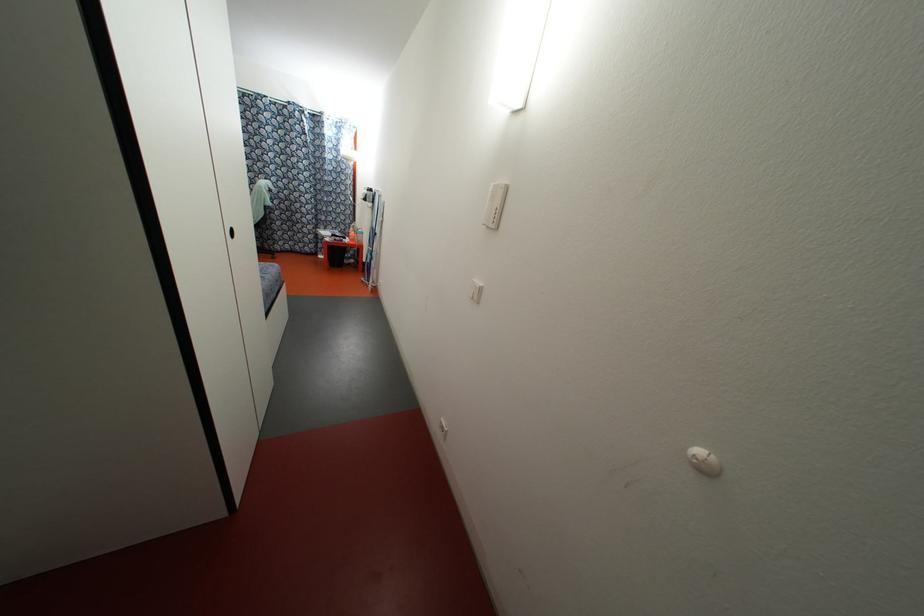
Where is `recessed door handle`? The image size is (924, 616). recessed door handle is located at coordinates (231, 233).